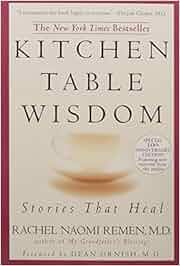
I want to click on saucer, so click(x=105, y=177).